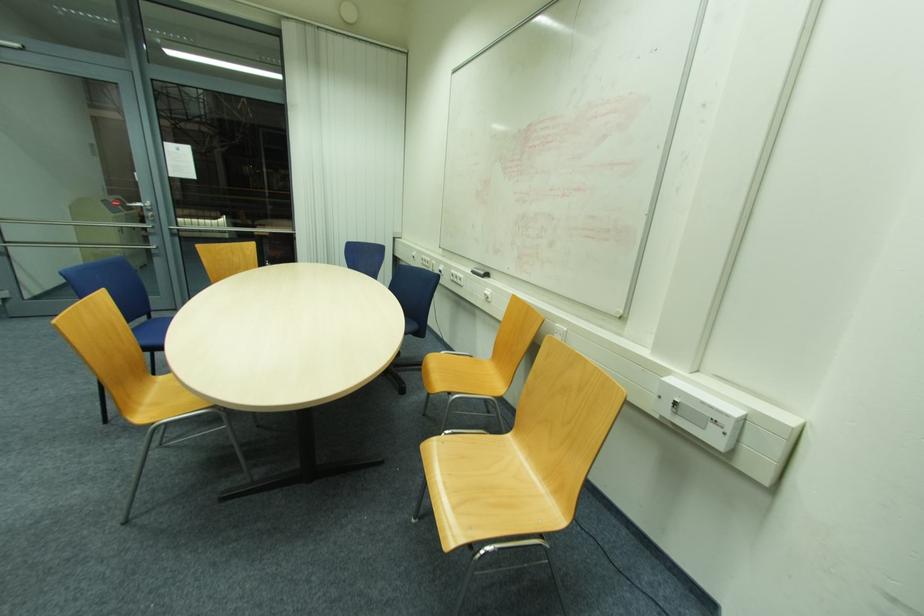
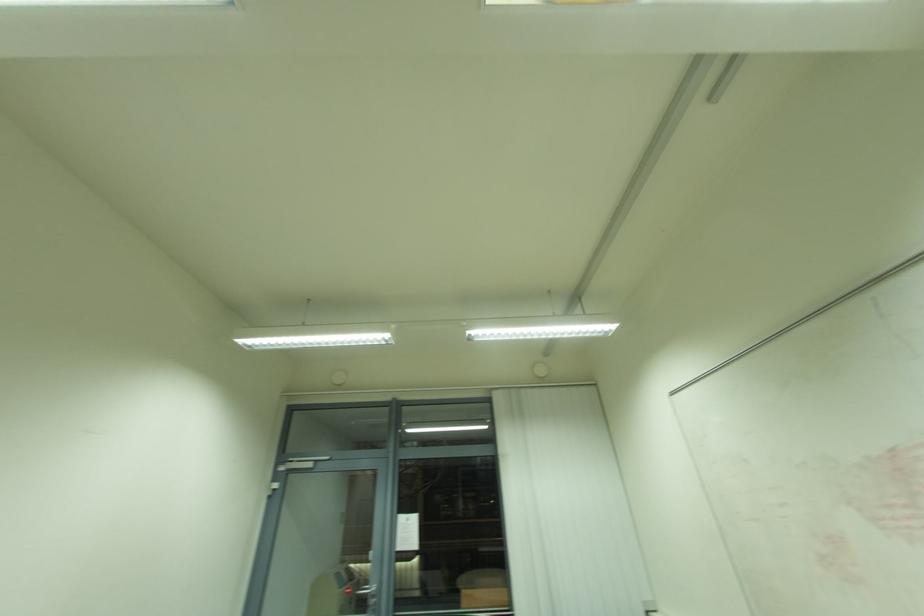
First-person continuous shooting, in which direction is the camera rotating?

The rotation direction of the camera is left-up.